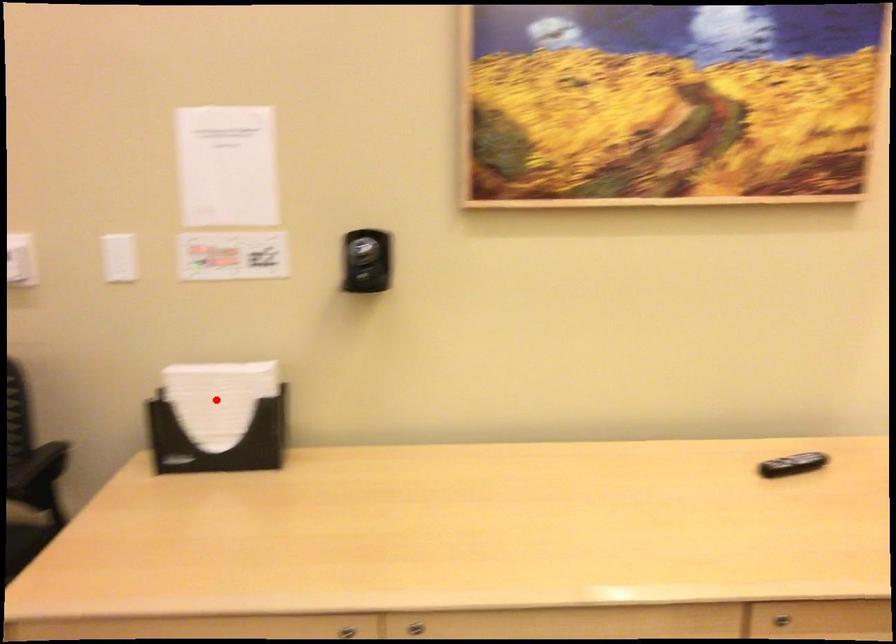
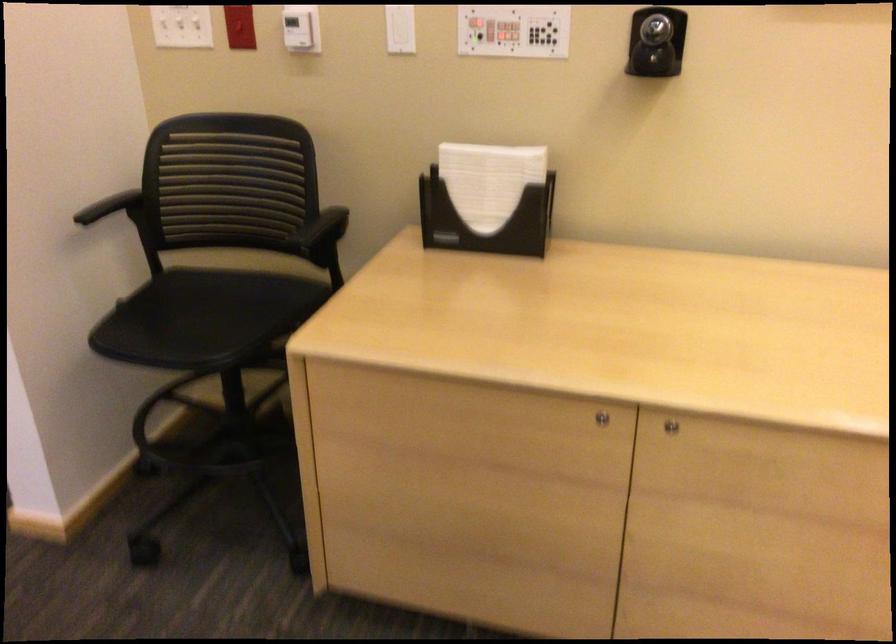
Where in the second image is the point corresponding to the highlighted location from the first image?

(488, 180)